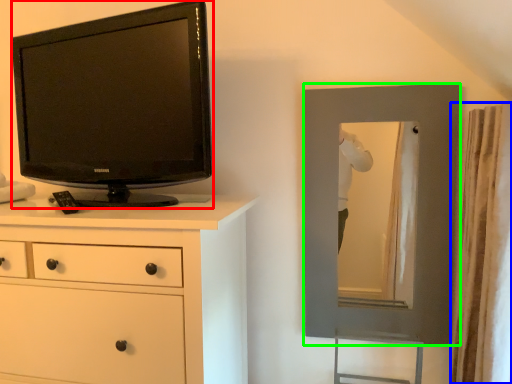
Question: Based on their relative distances, which object is nearer to television (highlighted by a red box)? Choose from curtain (highlighted by a blue box) and picture frame (highlighted by a green box).

Choices:
 (A) curtain
 (B) picture frame

Answer: (B)